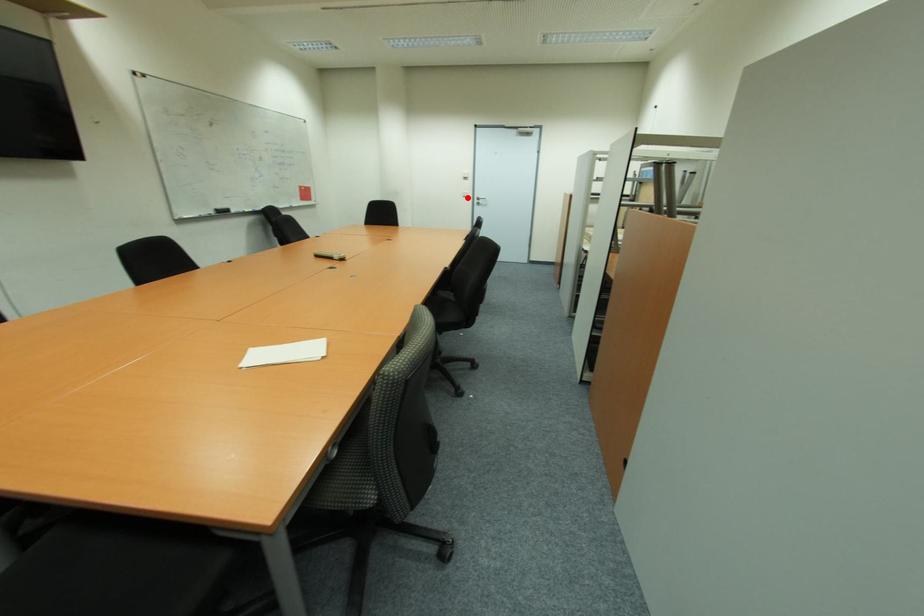
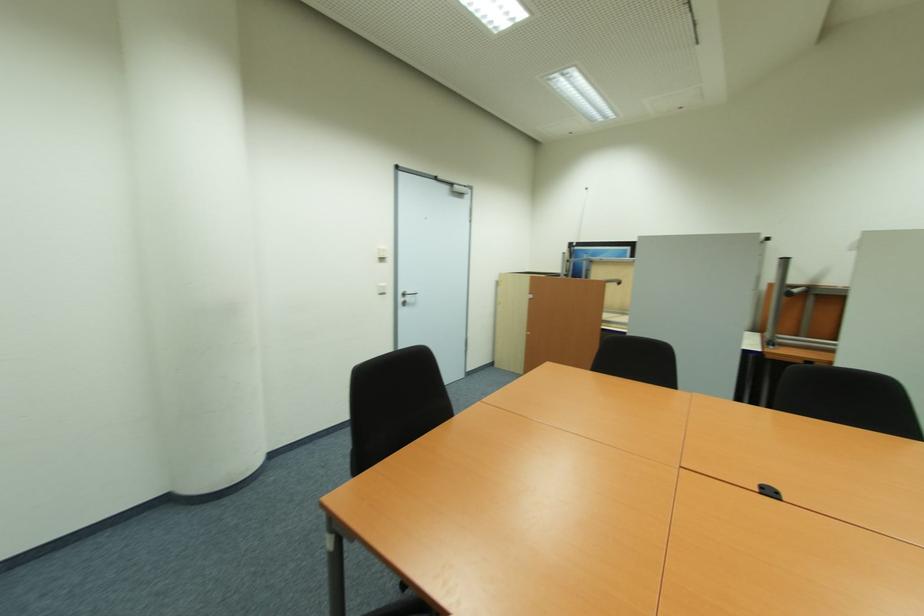
Question: I am providing you with two images of the same scene from different viewpoints. A red point is shown in image1. For the corresponding object point in image2, is it positioned nearer or farther from the camera?

Choices:
 (A) Nearer
 (B) Farther

Answer: (B)